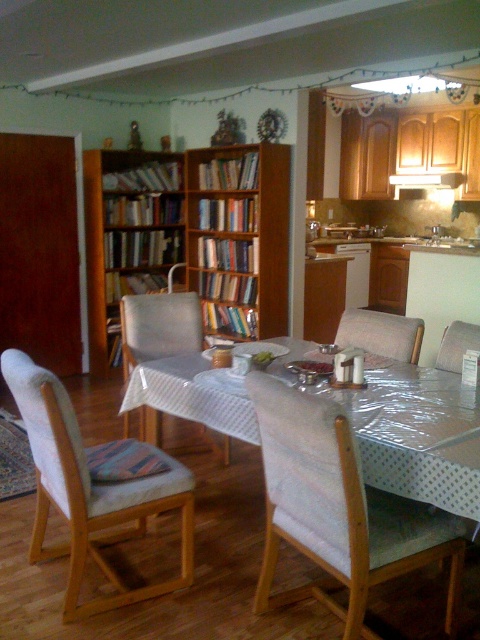
Does white fabric chair at left have a greater height compared to brown wooden bookshelf at center?

In fact, white fabric chair at left may be shorter than brown wooden bookshelf at center.

Does white fabric chair at left have a larger size compared to brown wooden bookshelf at center?

No.

Image resolution: width=480 pixels, height=640 pixels. Identify the location of white fabric chair at left. (90, 490).

Locate an element on the screen. white fabric chair at left is located at coordinates [x=90, y=490].

Can you confirm if brown wooden bookshelf at left is wider than suede-like beige armchair at center?

Yes.

Does point (97, 243) lie behind point (448, 369)?

Yes.

Describe the element at coordinates (128, 236) in the screenshot. This screenshot has height=640, width=480. I see `brown wooden bookshelf at left` at that location.

I want to click on brown wooden bookshelf at left, so click(x=128, y=236).

Can you confirm if white fabric armchair at center is bigger than light gray fabric armchair at center?

Yes, white fabric armchair at center is bigger than light gray fabric armchair at center.

Is white fabric armchair at center wider than light gray fabric armchair at center?

Correct, the width of white fabric armchair at center exceeds that of light gray fabric armchair at center.

Between point (167, 330) and point (405, 352), which one is positioned behind?

Positioned behind is point (167, 330).

Where is `white fabric armchair at center`? Image resolution: width=480 pixels, height=640 pixels. white fabric armchair at center is located at coordinates (158, 324).